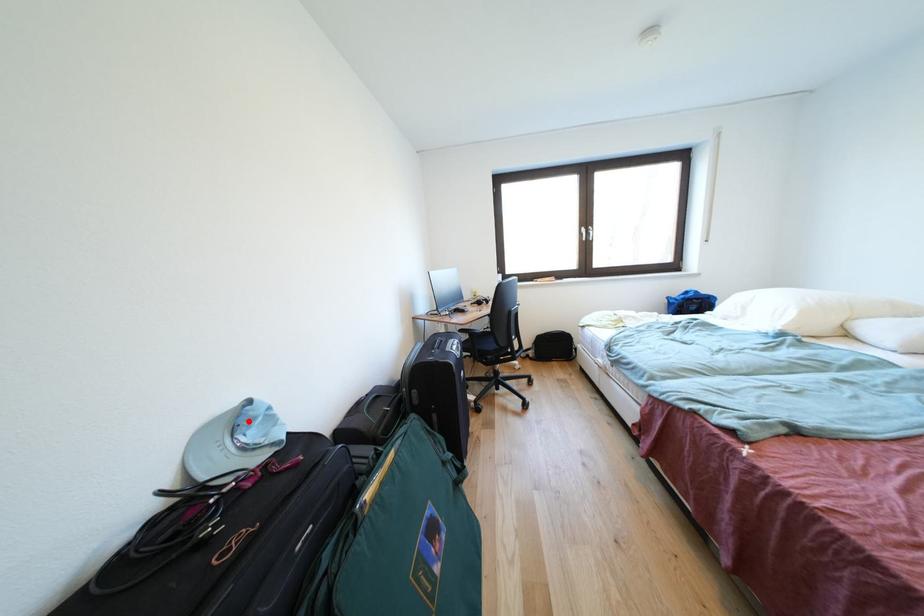
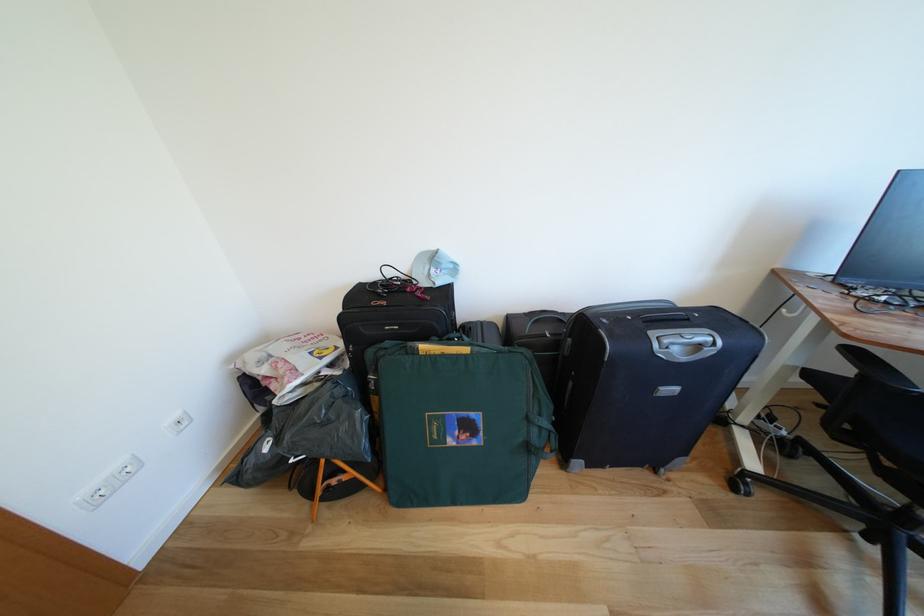
The point at the highlighted location is marked in the first image. Where is the corresponding point in the second image?

(442, 262)